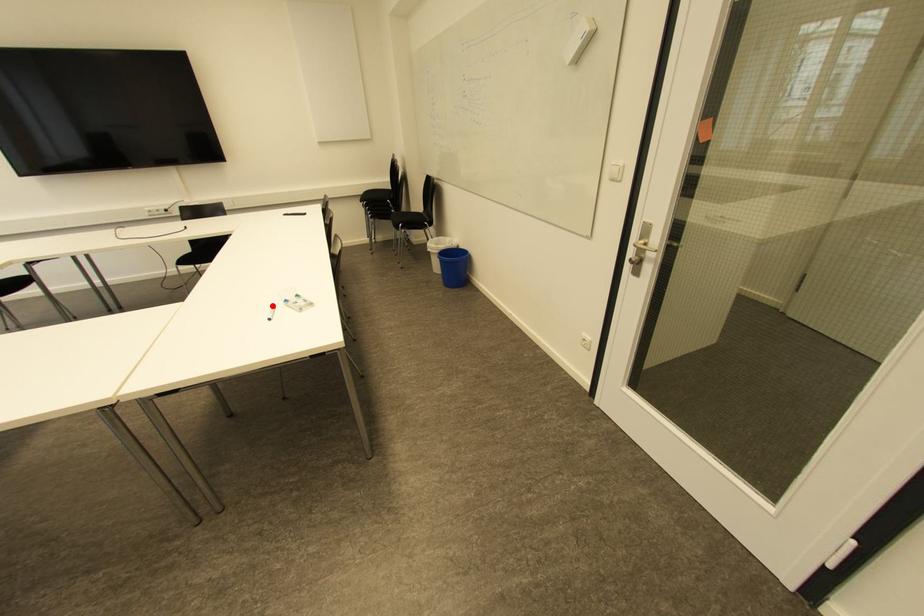
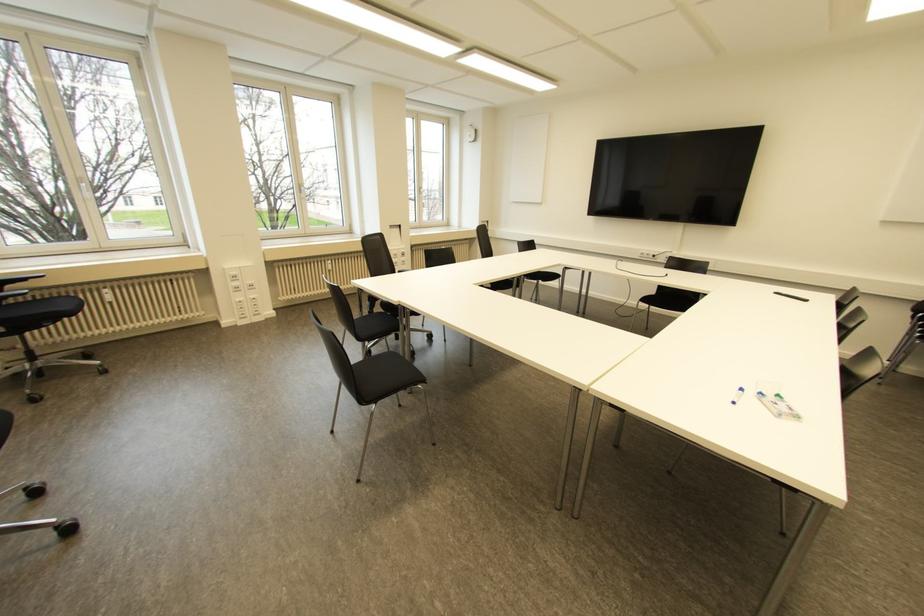
Question: I am providing you with two images of the same scene from different viewpoints. A red point is shown in image1. For the corresponding object point in image2, is it positioned nearer or farther from the camera?

Choices:
 (A) Nearer
 (B) Farther

Answer: (A)